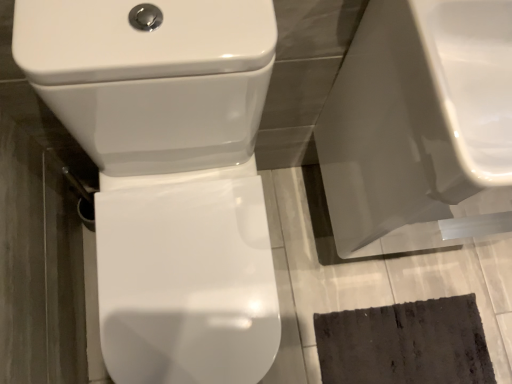
Question: Do you think white glossy toilet at center is within glossy ceramic sink at upper right, or outside of it?

Choices:
 (A) outside
 (B) inside

Answer: (A)

Question: Is white glossy toilet at center bigger or smaller than glossy ceramic sink at upper right?

Choices:
 (A) small
 (B) big

Answer: (B)

Question: Considering the real-world distances, which object is farthest from the white glossy toilet at center?

Choices:
 (A) glossy ceramic sink at upper right
 (B) white glossy toilet seat at center

Answer: (B)

Question: Which of these objects is positioned closest to the white glossy toilet seat at center?

Choices:
 (A) glossy ceramic sink at upper right
 (B) white glossy toilet at center

Answer: (A)